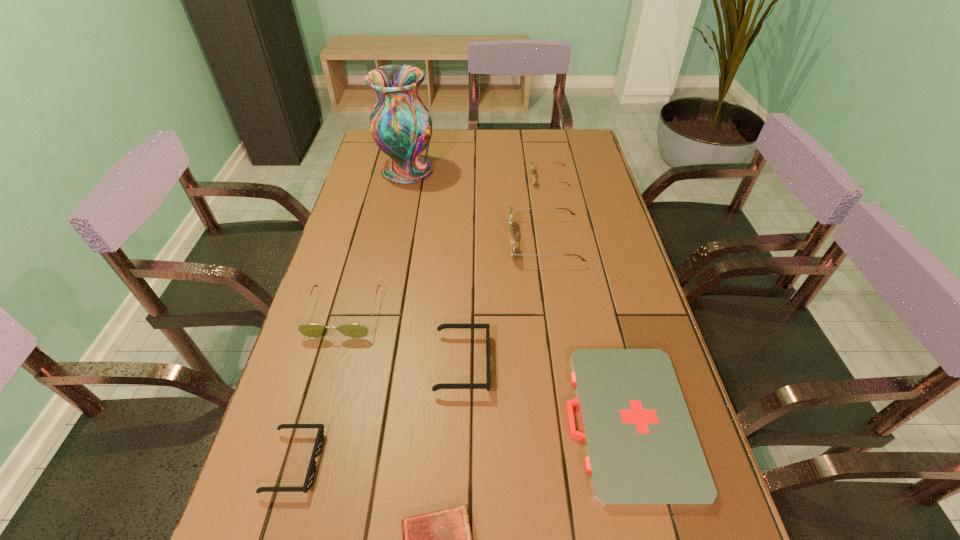
You are a GUI agent. You are given a task and a screenshot of the screen. Output one action in this format:
    pyautogui.click(x=<x>, y=<y>)
    Task: Click on the free region located 0.220m on the front-facing side of the farther black sunglasses
    The width and height of the screenshot is (960, 540).
    Given the screenshot: What is the action you would take?
    pyautogui.click(x=586, y=363)

Where is `vacant area located on the front-facing side of the nearest sunglasses`? The height and width of the screenshot is (540, 960). vacant area located on the front-facing side of the nearest sunglasses is located at coordinates (349, 462).

The height and width of the screenshot is (540, 960). Find the location of `vacant space situated on handle side the first-aid kit`. vacant space situated on handle side the first-aid kit is located at coordinates pos(394,421).

Image resolution: width=960 pixels, height=540 pixels. In order to click on free region located 0.220m on handle side the first-aid kit in this screenshot , I will do `click(461, 421)`.

The width and height of the screenshot is (960, 540). What are the coordinates of `vacant space located on handle side the first-aid kit` in the screenshot? It's located at click(x=384, y=421).

I want to click on object situated at the far edge, so point(401,126).

Where is `vase that is positioned at the left edge`? vase that is positioned at the left edge is located at coordinates (401, 126).

You are a GUI agent. You are given a task and a screenshot of the screen. Output one action in this format:
    pyautogui.click(x=<x>, y=<y>)
    Task: Click on the first-aid kit at the right edge
    The image size is (960, 540).
    Given the screenshot: What is the action you would take?
    pyautogui.click(x=642, y=450)

This screenshot has height=540, width=960. I want to click on object located in the far left corner section of the desktop, so pos(401,126).

The width and height of the screenshot is (960, 540). I want to click on free space at the far edge of the desktop, so click(495, 146).